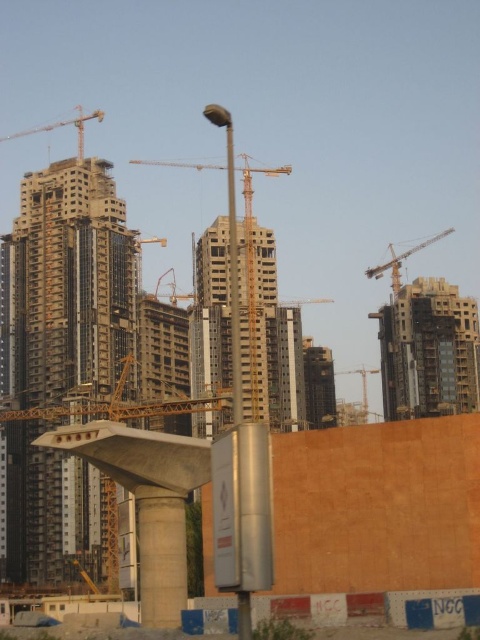
Question: Does concrete building at right appear over concrete building at center?

Choices:
 (A) yes
 (B) no

Answer: (B)

Question: Which object appears closest to the camera in this image?

Choices:
 (A) concrete building at center
 (B) concrete building at right

Answer: (A)

Question: Can you confirm if concrete building at left is positioned to the right of metallic gray crane at center?

Choices:
 (A) no
 (B) yes

Answer: (A)

Question: Among these points, which one is farthest from the camera?

Choices:
 (A) (62, 120)
 (B) (372, 369)
 (C) (88, 326)

Answer: (B)

Question: Is metallic yellow crane at center positioned in front of metallic gray crane at center?

Choices:
 (A) no
 (B) yes

Answer: (B)

Question: Which point appears closest to the camera in this image?

Choices:
 (A) (243, 324)
 (B) (364, 419)
 (C) (403, 259)
 (D) (74, 120)

Answer: (A)